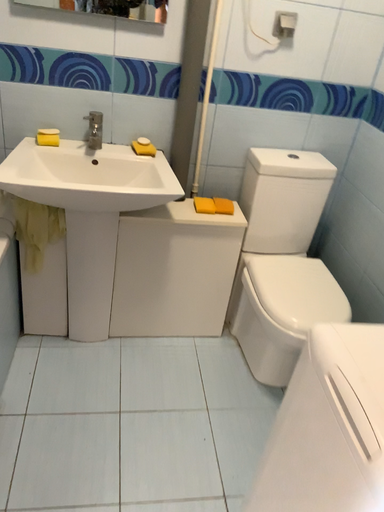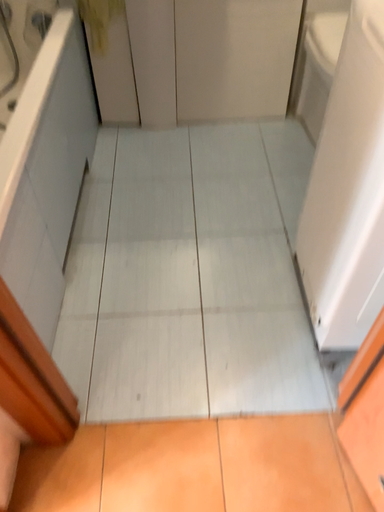
Question: Which way did the camera rotate in the video?

Choices:
 (A) rotated left
 (B) rotated right

Answer: (A)